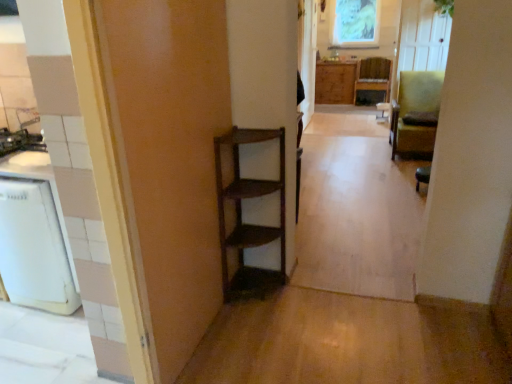
Question: From the image's perspective, is green textured fabric at upper center over wooden chair at center, which appears as the 3th chair when ordered from the bottom?

Choices:
 (A) yes
 (B) no

Answer: (A)

Question: Considering the relative positions of green textured fabric at upper center and wooden chair at center, acting as the first chair starting from the back, in the image provided, is green textured fabric at upper center to the left of wooden chair at center, acting as the first chair starting from the back, from the viewer's perspective?

Choices:
 (A) yes
 (B) no

Answer: (A)

Question: Is green textured fabric at upper center not within wooden chair at center, which appears as the 3th chair when ordered from the bottom?

Choices:
 (A) no
 (B) yes

Answer: (B)

Question: Is green textured fabric at upper center placed right next to wooden chair at center, acting as the first chair starting from the back?

Choices:
 (A) yes
 (B) no

Answer: (B)

Question: Is wooden chair at center, acting as the first chair starting from the back, completely or partially inside green textured fabric at upper center?

Choices:
 (A) no
 (B) yes

Answer: (A)

Question: Is green textured fabric at upper center smaller than wooden chair at center, the third chair from the front?

Choices:
 (A) yes
 (B) no

Answer: (A)

Question: Is wooden cabinet at center positioned far away from wooden chair at center, which appears as the 3th chair when ordered from the bottom?

Choices:
 (A) no
 (B) yes

Answer: (A)

Question: Can you confirm if wooden cabinet at center is smaller than wooden chair at center, the third chair from the front?

Choices:
 (A) no
 (B) yes

Answer: (B)

Question: Is wooden cabinet at center to the right of wooden chair at center, which appears as the 3th chair when ordered from the bottom, from the viewer's perspective?

Choices:
 (A) no
 (B) yes

Answer: (A)

Question: Considering the relative sizes of wooden cabinet at center and wooden chair at center, the first chair positioned from the top, in the image provided, is wooden cabinet at center shorter than wooden chair at center, the first chair positioned from the top,?

Choices:
 (A) no
 (B) yes

Answer: (A)

Question: From a real-world perspective, is wooden cabinet at center positioned over wooden chair at center, which appears as the 3th chair when ordered from the bottom, based on gravity?

Choices:
 (A) no
 (B) yes

Answer: (B)

Question: Does wooden cabinet at center lie behind wooden chair at center, acting as the first chair starting from the back?

Choices:
 (A) no
 (B) yes

Answer: (B)

Question: From a real-world perspective, is wooden chair at center, the first chair positioned from the top, located beneath green fabric chair at right, the 2th chair in the bottom-to-top sequence?

Choices:
 (A) yes
 (B) no

Answer: (A)